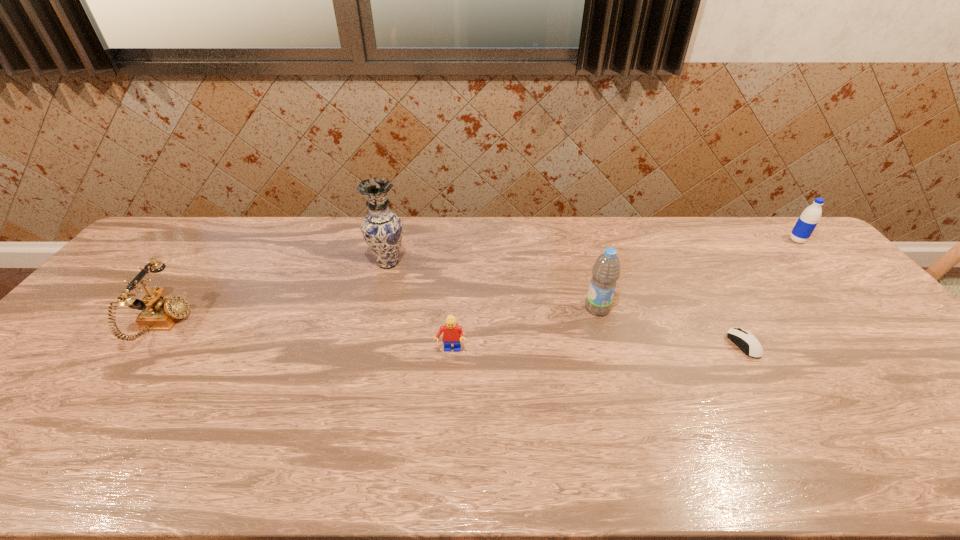
Locate an element on the screen. free point between the farther water bottle and the fifth nearest object is located at coordinates (592, 252).

The width and height of the screenshot is (960, 540). Identify the location of free spot between the Lego and the telephone. (307, 338).

The height and width of the screenshot is (540, 960). Find the location of `free point between the shortest object and the fourth object from left to right`. free point between the shortest object and the fourth object from left to right is located at coordinates (670, 327).

Locate an element on the screen. The height and width of the screenshot is (540, 960). free area in between the taller water bottle and the mouse is located at coordinates (670, 327).

Image resolution: width=960 pixels, height=540 pixels. In order to click on vacant area that lies between the vase and the fourth object from right to left in this screenshot , I will do `click(420, 307)`.

I want to click on free space between the Lego and the mouse, so click(x=597, y=348).

I want to click on object that is the closest to the Lego, so click(382, 229).

Where is `object that is the fourth closest to the right water bottle`? The width and height of the screenshot is (960, 540). object that is the fourth closest to the right water bottle is located at coordinates (382, 229).